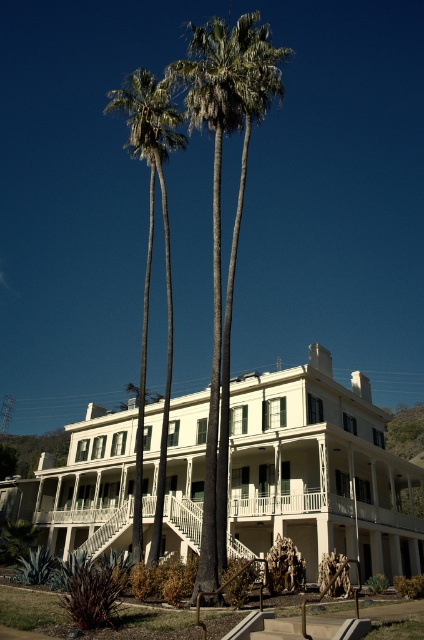
Question: Which of the following is the farthest from the observer?

Choices:
 (A) green leafy palm tree at center
 (B) green leafy palm at center

Answer: (B)

Question: Does green leafy palm tree at center appear on the right side of green leafy palm at center?

Choices:
 (A) yes
 (B) no

Answer: (A)

Question: Is green leafy palm tree at center bigger than green leafy palm at center?

Choices:
 (A) no
 (B) yes

Answer: (A)

Question: Which point is closer to the camera?

Choices:
 (A) (120, 102)
 (B) (215, 433)

Answer: (B)

Question: Does green leafy palm tree at center appear under green leafy palm at center?

Choices:
 (A) yes
 (B) no

Answer: (B)